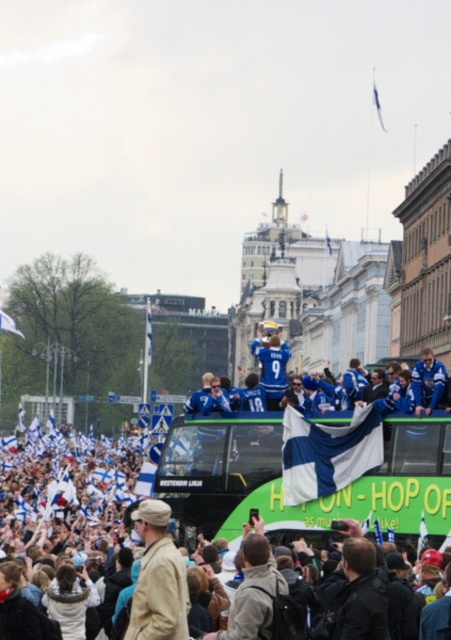
Is green fabric-covered bus at center smaller than blue jersey at center?

Correct, green fabric-covered bus at center occupies less space than blue jersey at center.

Does green fabric-covered bus at center appear over blue jersey at center?

No.

Locate an element on the screen. The width and height of the screenshot is (451, 640). green fabric-covered bus at center is located at coordinates (280, 476).

At what (x,y) coordinates should I click in order to perform the action: click on green fabric-covered bus at center. Please return your answer as a coordinate pair (x, y). The image size is (451, 640). Looking at the image, I should click on (280, 476).

Does white fabric crowd at lower center appear over tan fabric jacket at center?

No.

Does white fabric crowd at lower center have a larger size compared to tan fabric jacket at center?

Correct, white fabric crowd at lower center is larger in size than tan fabric jacket at center.

Is point (83, 472) positioned after point (127, 636)?

That is True.

Identify the location of white fabric crowd at lower center. (280, 477).

The height and width of the screenshot is (640, 451). Describe the element at coordinates (280, 476) in the screenshot. I see `green fabric-covered bus at center` at that location.

Between green fabric-covered bus at center and tan fabric jacket at center, which one is positioned higher?

green fabric-covered bus at center

Between point (382, 481) and point (160, 612), which one is positioned in front?

Point (160, 612) is in front.

The width and height of the screenshot is (451, 640). What are the coordinates of `green fabric-covered bus at center` in the screenshot? It's located at (280, 476).